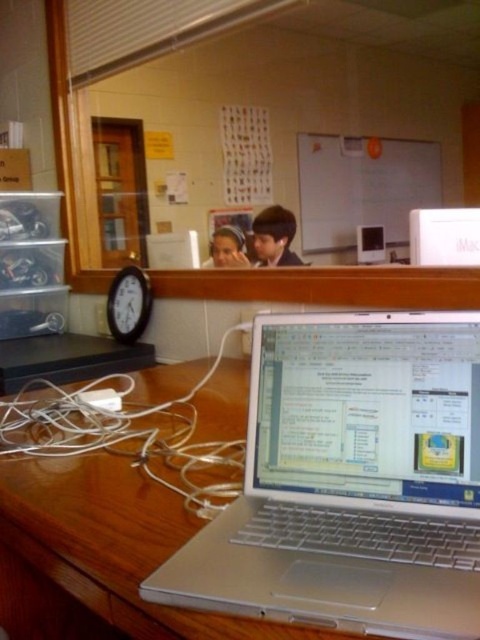
Question: Does silver metallic laptop at center have a greater width compared to wooden clock at left?

Choices:
 (A) yes
 (B) no

Answer: (A)

Question: Where is silver metallic laptop at center located in relation to silver metallic imac at center in the image?

Choices:
 (A) above
 (B) below

Answer: (B)

Question: Which of the following is the farthest from the observer?

Choices:
 (A) (x=240, y=502)
 (B) (x=479, y=214)
 (C) (x=128, y=291)

Answer: (C)

Question: Which point is closer to the camera taking this photo?

Choices:
 (A) (123, 291)
 (B) (479, 228)
 (C) (443, 550)

Answer: (C)

Question: Which object appears closest to the camera in this image?

Choices:
 (A) silver metallic imac at center
 (B) wooden clock at left
 (C) silver metallic laptop at center

Answer: (C)

Question: Does silver metallic imac at center have a greater width compared to wooden clock at left?

Choices:
 (A) yes
 (B) no

Answer: (B)